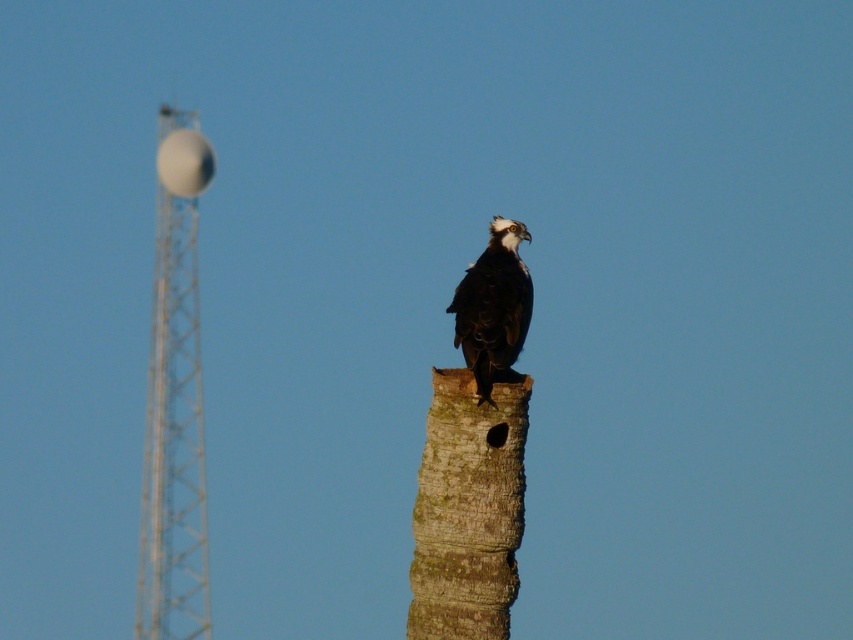
You are standing at the point marked by coordinates point (173, 440). Looking around, you see a bird perched on a tree stump and a tall metal structure in the background. Which object is closer to your current position?

The white metallic tower at left is closer to your current position since the coordinates point (173, 440) corresponds to it.

You are a birdwatcher standing in a field. You see the brown rough tree trunk at center and the white metallic tower at left. Which object is taller?

The white metallic tower at left is taller than the brown rough tree trunk at center.

You are a birdwatcher trying to capture a photo of the dark brown feathers at center. You notice a white metallic tower at left in the background. Based on their sizes, which object would appear wider in your camera viewfinder?

The white metallic tower at left appears wider in the camera viewfinder because its width is larger than that of the dark brown feathers at center.